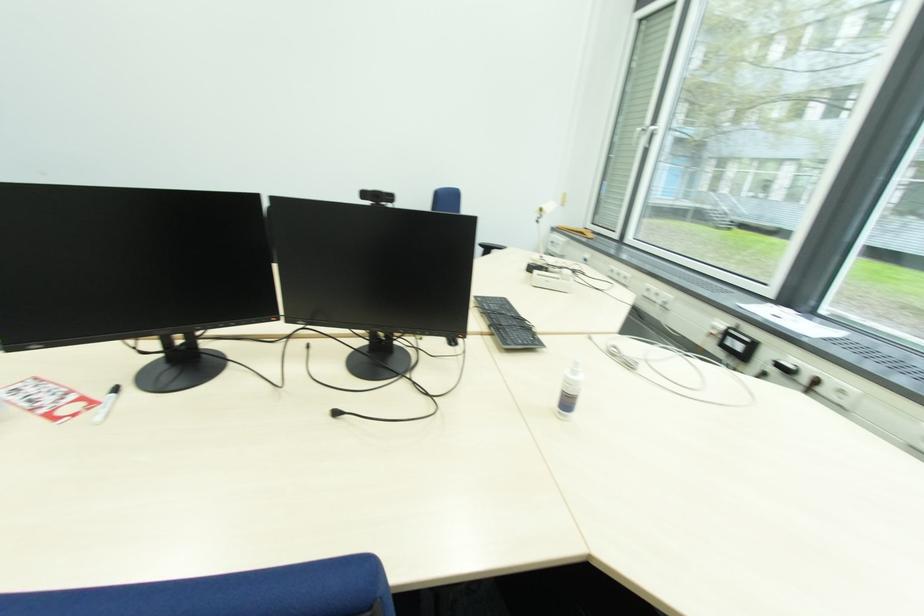
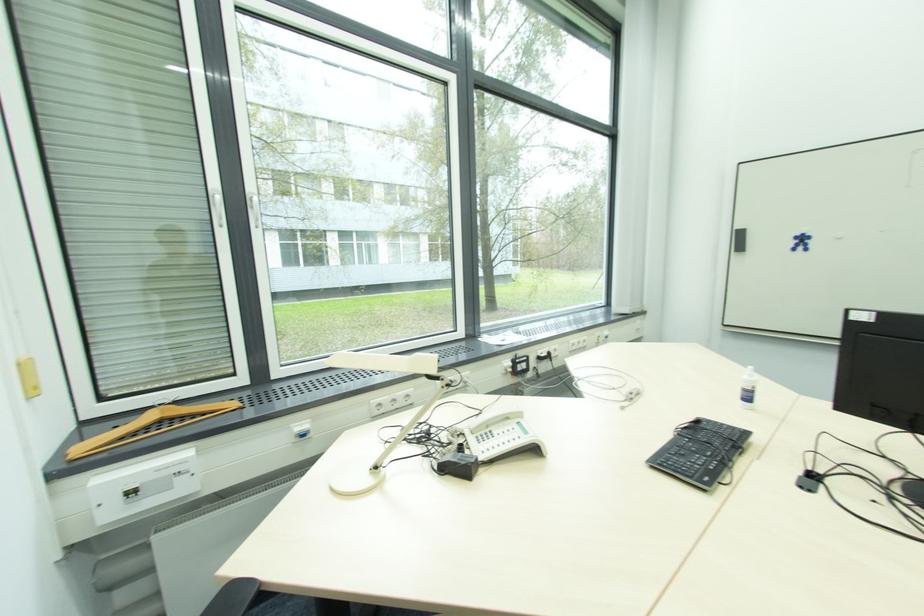
In the second image, find the point that corresponds to (x=570, y=405) in the first image.

(750, 400)